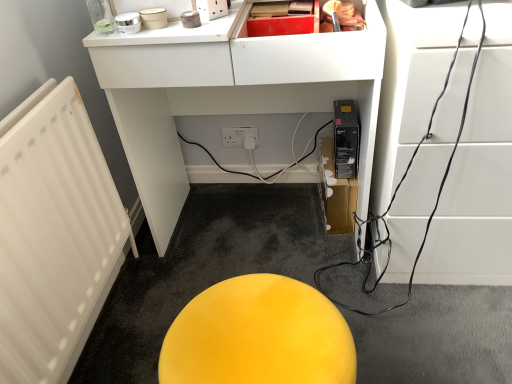
This screenshot has height=384, width=512. What do you see at coordinates (229, 95) in the screenshot?
I see `matte black computer tower at lower center, the 3th furniture from the right` at bounding box center [229, 95].

You are a GUI agent. You are given a task and a screenshot of the screen. Output one action in this format:
    pyautogui.click(x=<x>, y=<y>)
    Task: Click on the matte black computer tower at lower center, which is the first furniture from left to right
    The height and width of the screenshot is (384, 512).
    Given the screenshot: What is the action you would take?
    pyautogui.click(x=229, y=95)

Is matte black computer tower at lower center, the 3th furniture from the right, far from black glossy cable at right, the 1th furniture positioned from the right?

That's not correct — matte black computer tower at lower center, the 3th furniture from the right, is a little close to black glossy cable at right, the 1th furniture positioned from the right.

From the image's perspective, does matte black computer tower at lower center, the 3th furniture from the right, appear lower than black glossy cable at right, the 1th furniture positioned from the right?

No, from the image's perspective, matte black computer tower at lower center, the 3th furniture from the right, is not below black glossy cable at right, the 1th furniture positioned from the right.

How many degrees apart are the facing directions of matte black computer tower at lower center, the 3th furniture from the right, and black glossy cable at right, which appears as the third furniture when viewed from the left?

They differ by 0.00026 degrees in their facing directions.

Would you consider yellow matte stool at center, which appears as the second furniture when viewed from the right, to be distant from black glossy cable at right, which appears as the third furniture when viewed from the left?

yellow matte stool at center, which appears as the second furniture when viewed from the right, is actually quite close to black glossy cable at right, which appears as the third furniture when viewed from the left.

Considering the positions of objects yellow matte stool at center, which appears as the second furniture when viewed from the right, and black glossy cable at right, which appears as the third furniture when viewed from the left, in the image provided, who is more to the left, yellow matte stool at center, which appears as the second furniture when viewed from the right, or black glossy cable at right, which appears as the third furniture when viewed from the left,?

yellow matte stool at center, which appears as the second furniture when viewed from the right.

Considering the positions of point (234, 358) and point (485, 277), is point (234, 358) closer or farther from the camera than point (485, 277)?

Clearly, point (234, 358) is closer to the camera than point (485, 277).

Could you tell me if yellow matte stool at center, which appears as the second furniture when viewed from the right, is turned towards black glossy cable at right, which appears as the third furniture when viewed from the left?

No, yellow matte stool at center, which appears as the second furniture when viewed from the right, is not facing towards black glossy cable at right, which appears as the third furniture when viewed from the left.

Considering the relative positions of yellow matte stool at center, which is counted as the second furniture, starting from the left, and matte black computer tower at lower center, the 3th furniture from the right, in the image provided, is yellow matte stool at center, which is counted as the second furniture, starting from the left, to the left of matte black computer tower at lower center, the 3th furniture from the right, from the viewer's perspective?

No, yellow matte stool at center, which is counted as the second furniture, starting from the left, is not to the left of matte black computer tower at lower center, the 3th furniture from the right.

Where is `the 2nd furniture above the yellow matte stool at center, which is counted as the second furniture, starting from the left (from the image's perspective)`? The width and height of the screenshot is (512, 384). the 2nd furniture above the yellow matte stool at center, which is counted as the second furniture, starting from the left (from the image's perspective) is located at coordinates (229, 95).

How many degrees apart are the facing directions of yellow matte stool at center, which appears as the second furniture when viewed from the right, and matte black computer tower at lower center, the 3th furniture from the right?

89.2 degrees.

Is matte black computer tower at lower center, which is the first furniture from left to right, spatially inside yellow matte stool at center, which is counted as the second furniture, starting from the left, or outside of it?

matte black computer tower at lower center, which is the first furniture from left to right, lies outside yellow matte stool at center, which is counted as the second furniture, starting from the left.

Considering the relative sizes of matte black computer tower at lower center, the 3th furniture from the right, and yellow matte stool at center, which appears as the second furniture when viewed from the right, in the image provided, is matte black computer tower at lower center, the 3th furniture from the right, bigger than yellow matte stool at center, which appears as the second furniture when viewed from the right,?

Correct, matte black computer tower at lower center, the 3th furniture from the right, is larger in size than yellow matte stool at center, which appears as the second furniture when viewed from the right.

Between matte black computer tower at lower center, the 3th furniture from the right, and yellow matte stool at center, which appears as the second furniture when viewed from the right, which one appears on the right side from the viewer's perspective?

yellow matte stool at center, which appears as the second furniture when viewed from the right.

From a real-world perspective, is black glossy cable at right, which appears as the third furniture when viewed from the left, over matte black computer tower at lower center, the 3th furniture from the right?

Incorrect, from a real-world perspective, black glossy cable at right, which appears as the third furniture when viewed from the left, is lower than matte black computer tower at lower center, the 3th furniture from the right.

From the image's perspective, relative to matte black computer tower at lower center, the 3th furniture from the right, is black glossy cable at right, which appears as the third furniture when viewed from the left, above or below?

Based on their image positions, black glossy cable at right, which appears as the third furniture when viewed from the left, is located beneath matte black computer tower at lower center, the 3th furniture from the right.

Is black glossy cable at right, the 1th furniture positioned from the right, beside yellow matte stool at center, which is counted as the second furniture, starting from the left?

No, black glossy cable at right, the 1th furniture positioned from the right, is not next to yellow matte stool at center, which is counted as the second furniture, starting from the left.

Which is in front, point (476, 191) or point (170, 331)?

The point (170, 331) is more forward.

Locate an element on the screen. the 1st furniture below the matte black computer tower at lower center, which is the first furniture from left to right (from a real-world perspective) is located at coordinates (479, 176).

Where is `the 1st furniture above the yellow matte stool at center, which appears as the second furniture when viewed from the right (from the image's perspective)`? The height and width of the screenshot is (384, 512). the 1st furniture above the yellow matte stool at center, which appears as the second furniture when viewed from the right (from the image's perspective) is located at coordinates (479, 176).

Looking at this image, based on their spatial positions, is black glossy cable at right, the 1th furniture positioned from the right, or matte black computer tower at lower center, the 3th furniture from the right, closer to yellow matte stool at center, which appears as the second furniture when viewed from the right?

The object closer to yellow matte stool at center, which appears as the second furniture when viewed from the right, is black glossy cable at right, the 1th furniture positioned from the right.

Based on their spatial positions, is matte black computer tower at lower center, which is the first furniture from left to right, or yellow matte stool at center, which appears as the second furniture when viewed from the right, further from black glossy cable at right, the 1th furniture positioned from the right?

yellow matte stool at center, which appears as the second furniture when viewed from the right, lies further to black glossy cable at right, the 1th furniture positioned from the right, than the other object.

Which object lies nearer to the anchor point matte black computer tower at lower center, which is the first furniture from left to right, yellow matte stool at center, which appears as the second furniture when viewed from the right, or black glossy cable at right, the 1th furniture positioned from the right?

Among the two, black glossy cable at right, the 1th furniture positioned from the right, is located nearer to matte black computer tower at lower center, which is the first furniture from left to right.

Estimate the real-world distances between objects in this image. Which object is further from matte black computer tower at lower center, the 3th furniture from the right, black glossy cable at right, which appears as the third furniture when viewed from the left, or yellow matte stool at center, which appears as the second furniture when viewed from the right?

yellow matte stool at center, which appears as the second furniture when viewed from the right, lies further to matte black computer tower at lower center, the 3th furniture from the right, than the other object.

Estimate the real-world distances between objects in this image. Which object is closer to yellow matte stool at center, which is counted as the second furniture, starting from the left, matte black computer tower at lower center, the 3th furniture from the right, or black glossy cable at right, which appears as the third furniture when viewed from the left?

The object closer to yellow matte stool at center, which is counted as the second furniture, starting from the left, is black glossy cable at right, which appears as the third furniture when viewed from the left.

Looking at the image, which one is located closer to black glossy cable at right, which appears as the third furniture when viewed from the left, yellow matte stool at center, which is counted as the second furniture, starting from the left, or matte black computer tower at lower center, the 3th furniture from the right?

Based on the image, matte black computer tower at lower center, the 3th furniture from the right, appears to be nearer to black glossy cable at right, which appears as the third furniture when viewed from the left.

You are a GUI agent. You are given a task and a screenshot of the screen. Output one action in this format:
    pyautogui.click(x=<x>, y=<y>)
    Task: Click on the furniture situated between matte black computer tower at lower center, the 3th furniture from the right, and black glossy cable at right, which appears as the third furniture when viewed from the left, from left to right
    This screenshot has width=512, height=384.
    Given the screenshot: What is the action you would take?
    pyautogui.click(x=258, y=336)